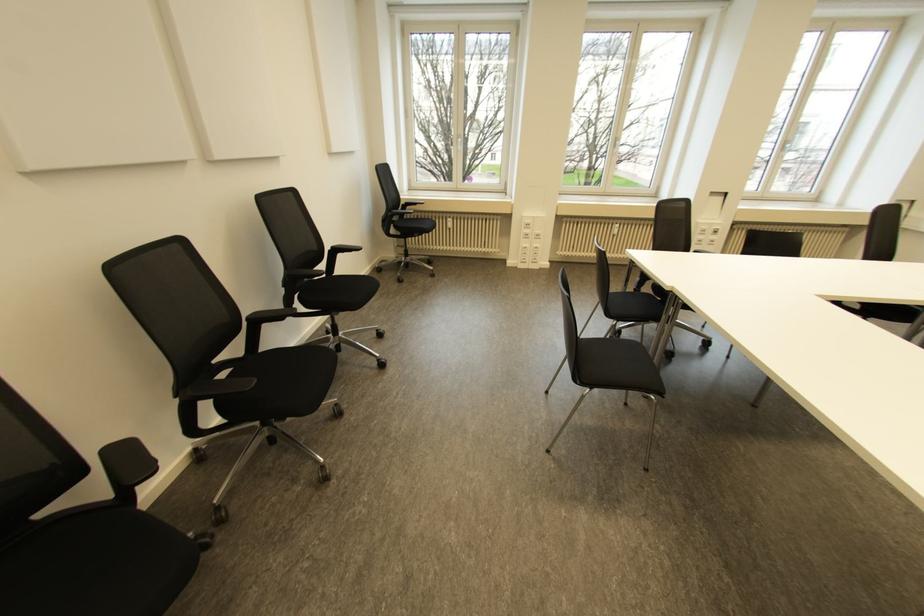
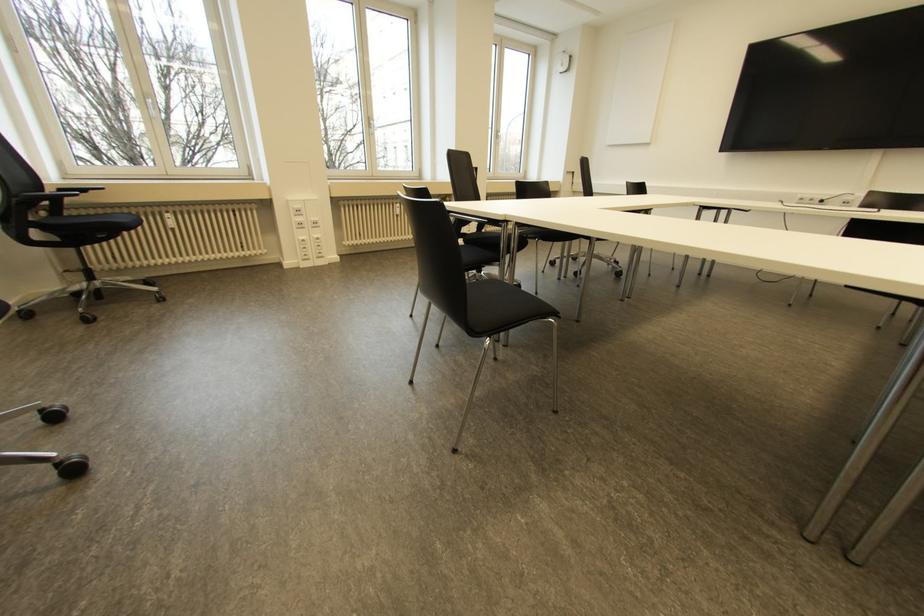
The point at (616,225) is marked in the first image. Where is the corresponding point in the second image?

(397, 204)